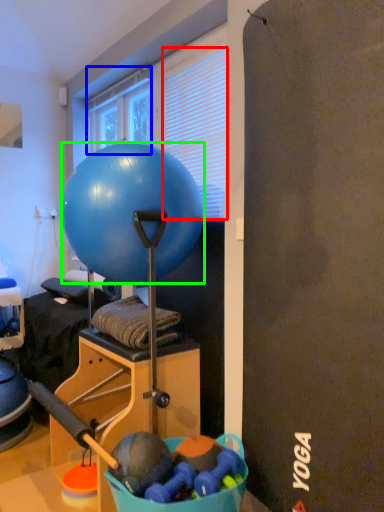
Question: Which is nearer to the blind (highlighted by a red box)? window (highlighted by a blue box) or ball (highlighted by a green box).

Choices:
 (A) window
 (B) ball

Answer: (B)